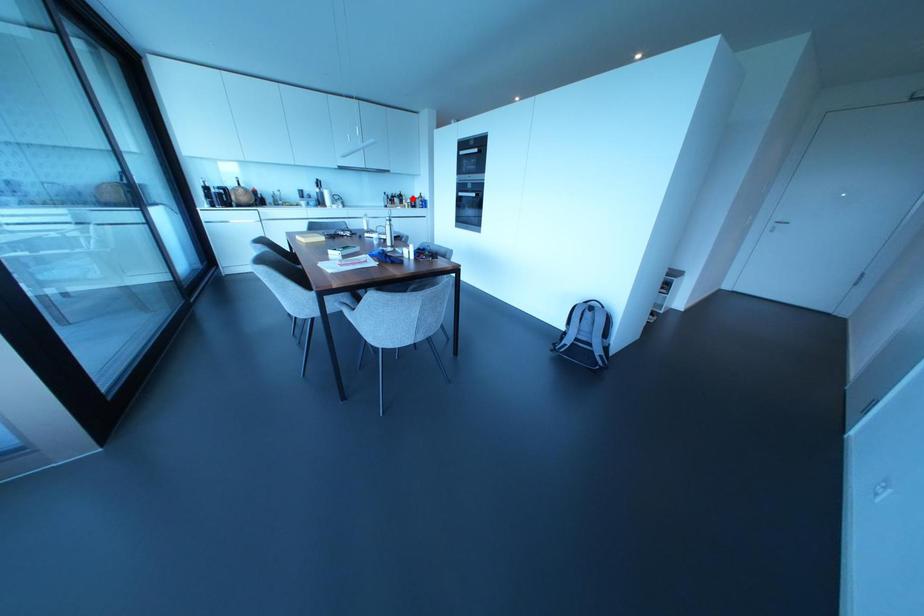
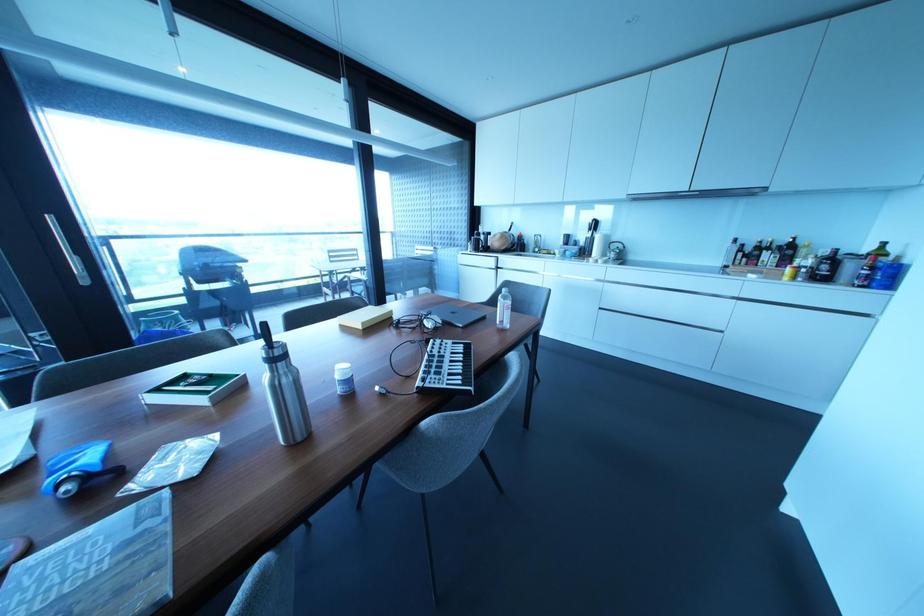
Question: I am providing you with two images of the same scene from different viewpoints. In image1, a red point is highlighted. Considering the same 3D point in image2, which of the following is correct?

Choices:
 (A) It is closer
 (B) It is farther

Answer: (B)